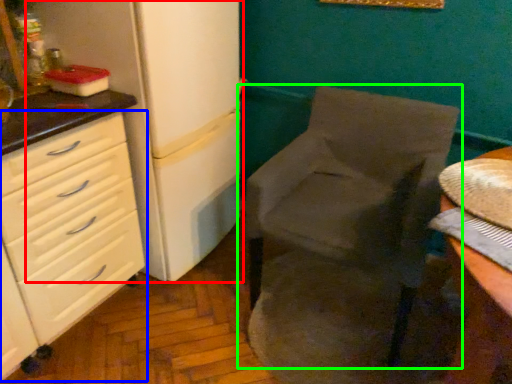
Question: Which is nearer to the refrigerator (highlighted by a red box)? chest of drawers (highlighted by a blue box) or chair (highlighted by a green box).

Choices:
 (A) chest of drawers
 (B) chair

Answer: (A)